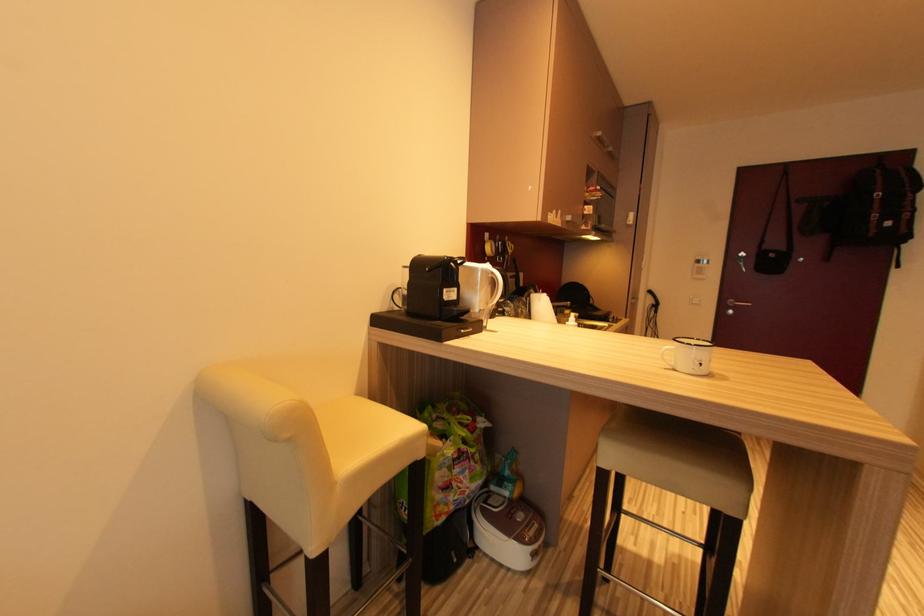
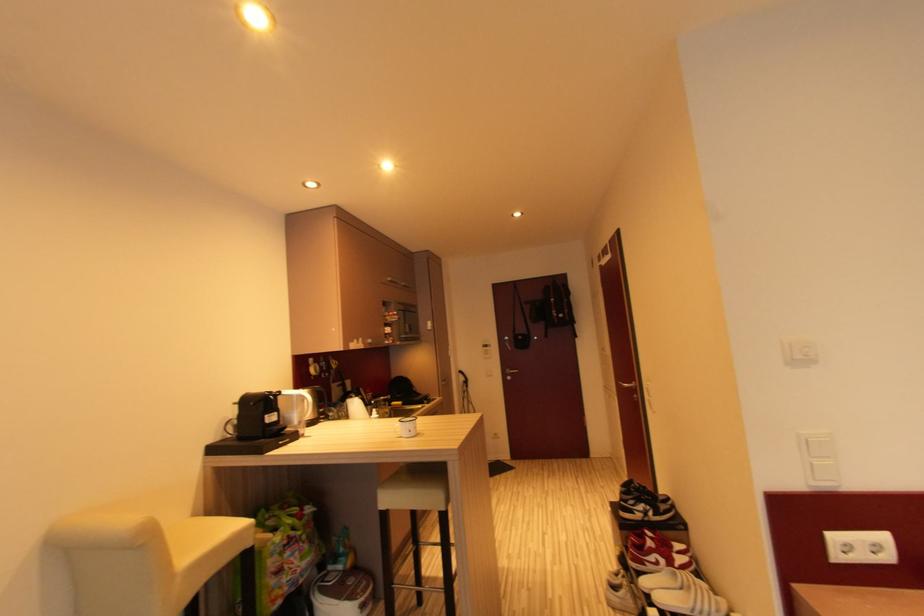
Question: In a continuous first-person perspective shot, in which direction is the camera moving?

Choices:
 (A) Left
 (B) Right
 (C) Forward
 (D) Backward

Answer: (D)